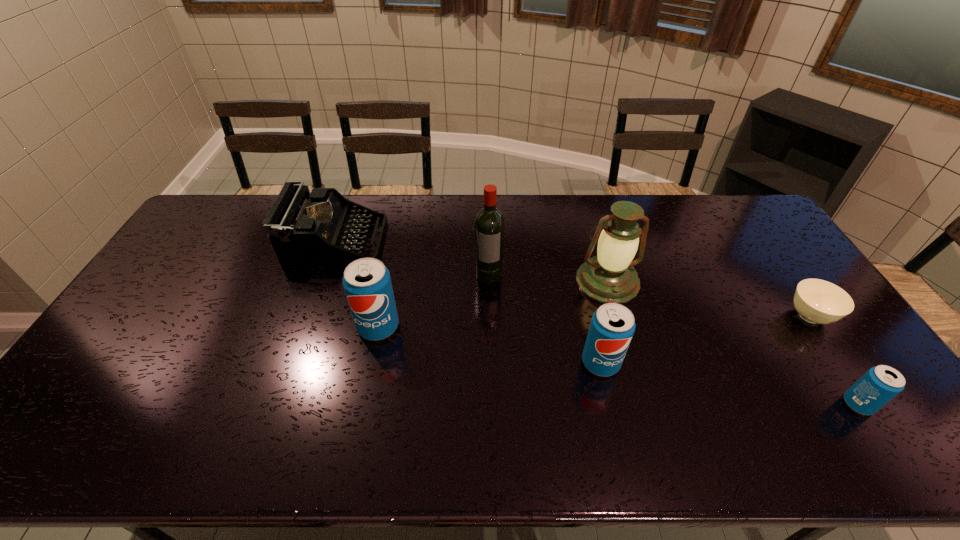
Find the location of a particular element. the leftmost soda can is located at coordinates (367, 284).

Find the location of a particular element. The image size is (960, 540). the sixth farthest object is located at coordinates (612, 326).

This screenshot has width=960, height=540. I want to click on the second soda can from left to right, so click(612, 326).

Locate an element on the screen. This screenshot has height=540, width=960. the nearest soda can is located at coordinates (880, 384).

Where is `the shortest soda can`? The image size is (960, 540). the shortest soda can is located at coordinates (880, 384).

The width and height of the screenshot is (960, 540). Identify the location of wine bottle. (489, 223).

This screenshot has width=960, height=540. Identify the location of the second tallest object. (610, 277).

Image resolution: width=960 pixels, height=540 pixels. Find the location of `the third shortest object`. the third shortest object is located at coordinates (304, 228).

Locate an element on the screen. This screenshot has width=960, height=540. sugar bowl is located at coordinates tap(817, 301).

You are a GUI agent. You are given a task and a screenshot of the screen. Output one action in this format:
    pyautogui.click(x=<x>, y=<y>)
    Task: Click on the free space located on the right of the farthest soda can
    
    Given the screenshot: What is the action you would take?
    525,327